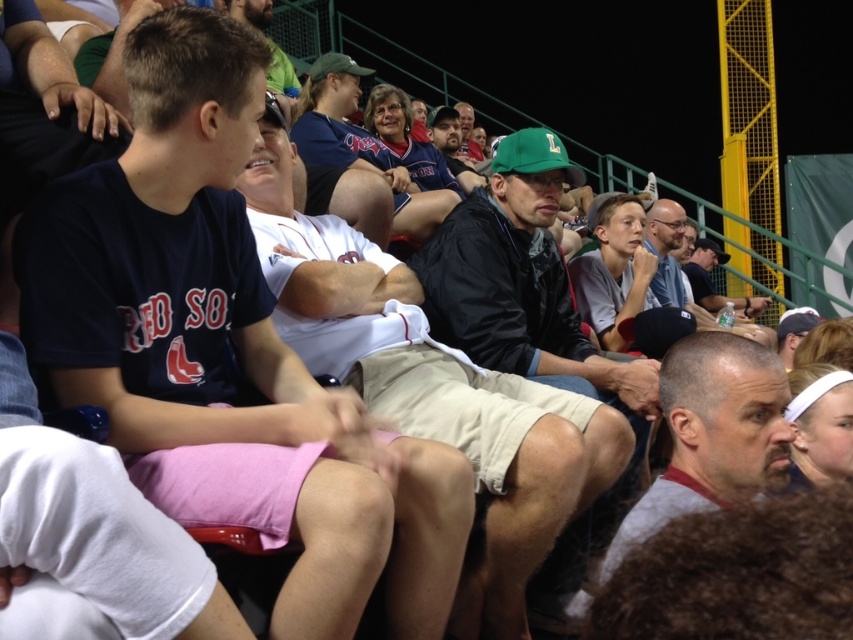
You are a photographer standing in the crowd at the baseball game. You want to take a photo of the green fabric cap at center and the khaki shorts at center. Which object is positioned to the right of the other?

The khaki shorts at center is to the right of the green fabric cap at center.

You are a photographer trying to capture a photo of both the dark blue jersey at center and the green fabric cap at center. Which object should you adjust your camera focus to first if you want to ensure both are in the frame?

The dark blue jersey at center is positioned on the left side of green fabric cap at center, so you should focus on the dark blue jersey at center first to ensure both are in the frame.